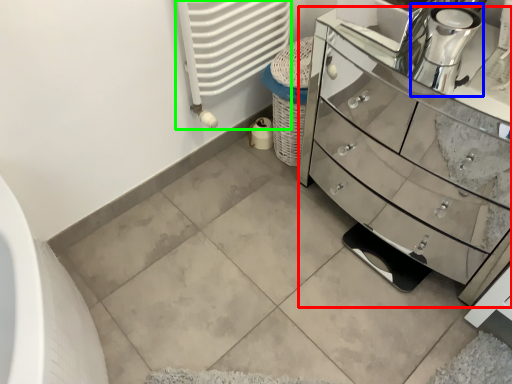
Question: Considering the real-world distances, which object is farthest from chest of drawers (highlighted by a red box)? coffee machine (highlighted by a blue box) or radiator (highlighted by a green box)?

Choices:
 (A) coffee machine
 (B) radiator

Answer: (A)